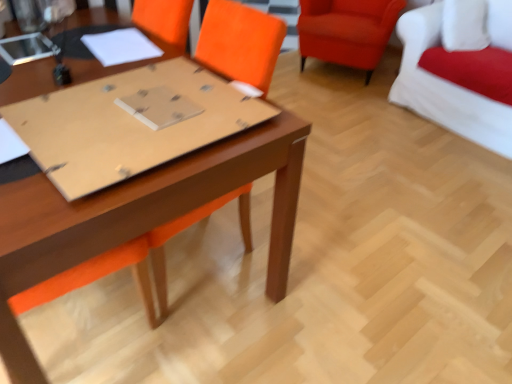
Question: Is matte brown table at center beside velvet orange armchair at upper right, positioned as the first chair in left-to-right order?

Choices:
 (A) yes
 (B) no

Answer: (B)

Question: From a real-world perspective, is matte brown table at center physically below velvet orange armchair at upper right, positioned as the first chair in left-to-right order?

Choices:
 (A) no
 (B) yes

Answer: (A)

Question: Is matte brown table at center taller than velvet orange armchair at upper right, positioned as the first chair in left-to-right order?

Choices:
 (A) yes
 (B) no

Answer: (A)

Question: Is matte brown table at center thinner than velvet orange armchair at upper right, positioned as the first chair in left-to-right order?

Choices:
 (A) no
 (B) yes

Answer: (A)

Question: Is velvet orange armchair at upper right, positioned as the 2th chair in right-to-left order, at the back of matte brown table at center?

Choices:
 (A) yes
 (B) no

Answer: (B)

Question: Is matte brown table at center shorter than velvet orange armchair at upper right, positioned as the first chair in left-to-right order?

Choices:
 (A) yes
 (B) no

Answer: (B)

Question: Is velvet orange armchair at upper right, positioned as the first chair in left-to-right order, at the back of matte cardboard at center?

Choices:
 (A) no
 (B) yes

Answer: (A)

Question: Is matte cardboard at center far from velvet orange armchair at upper right, positioned as the 2th chair in right-to-left order?

Choices:
 (A) yes
 (B) no

Answer: (A)

Question: Is matte cardboard at center thinner than velvet orange armchair at upper right, positioned as the first chair in left-to-right order?

Choices:
 (A) yes
 (B) no

Answer: (A)

Question: Is matte cardboard at center smaller than velvet orange armchair at upper right, positioned as the 2th chair in right-to-left order?

Choices:
 (A) yes
 (B) no

Answer: (A)

Question: From a real-world perspective, is matte cardboard at center physically above velvet orange armchair at upper right, positioned as the first chair in left-to-right order?

Choices:
 (A) no
 (B) yes

Answer: (B)

Question: Does matte cardboard at center come behind velvet orange armchair at upper right, positioned as the 2th chair in right-to-left order?

Choices:
 (A) yes
 (B) no

Answer: (B)

Question: Is the position of matte cardboard at center more distant than that of white fabric couch at upper right, placed as the first chair when sorted from right to left?

Choices:
 (A) yes
 (B) no

Answer: (B)